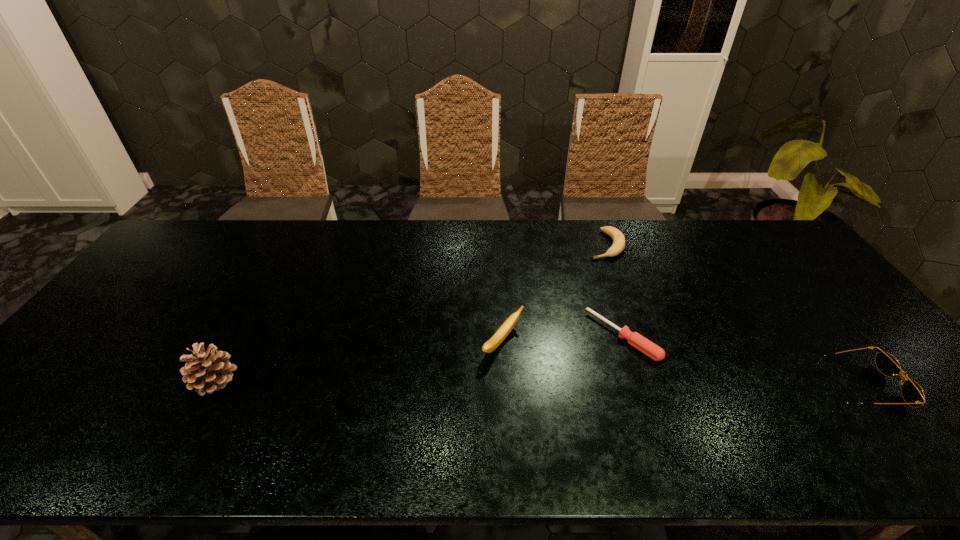
What are the coordinates of `pinecone that is at the near edge` in the screenshot? It's located at (x=206, y=371).

Where is `sunglasses positioned at the near edge`? The height and width of the screenshot is (540, 960). sunglasses positioned at the near edge is located at coordinates (912, 393).

The width and height of the screenshot is (960, 540). I want to click on object situated at the right edge, so click(912, 393).

You are a GUI agent. You are given a task and a screenshot of the screen. Output one action in this format:
    pyautogui.click(x=<x>, y=<y>)
    Task: Click on the object at the near right corner
    Image resolution: width=960 pixels, height=540 pixels.
    Given the screenshot: What is the action you would take?
    pyautogui.click(x=912, y=393)

Image resolution: width=960 pixels, height=540 pixels. What are the coordinates of `vacant space at the far edge` in the screenshot? It's located at 281,234.

The height and width of the screenshot is (540, 960). In the image, there is a desktop. In order to click on free space at the near edge in this screenshot , I will do `click(854, 402)`.

Identify the location of vacant space at the right edge of the desktop. (853, 370).

Find the location of a particular element. The height and width of the screenshot is (540, 960). vacant region at the far left corner of the desktop is located at coordinates point(170,260).

I want to click on free region at the far right corner of the desktop, so pyautogui.click(x=731, y=220).

Identify the location of vacant space in between the leftmost object and the nearer banana. (359, 362).